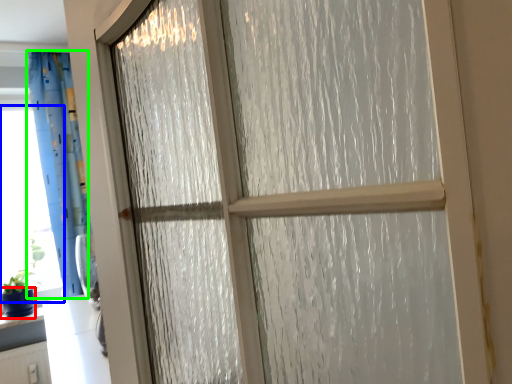
Question: Which object is positioned closest to glass vase (highlighted by a red box)? Select from window screen (highlighted by a blue box) and curtain (highlighted by a green box).

Choices:
 (A) window screen
 (B) curtain

Answer: (A)